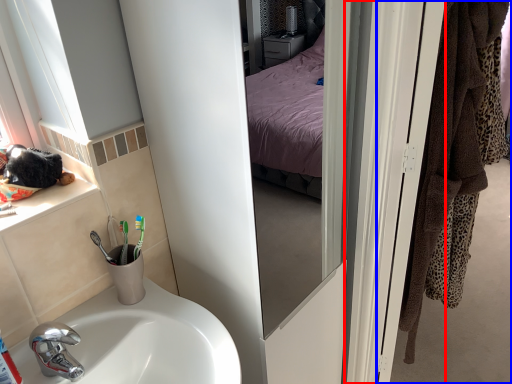
Question: Which object is closer to the camera taking this photo, screen door (highlighted by a red box) or door (highlighted by a blue box)?

Choices:
 (A) screen door
 (B) door

Answer: (A)